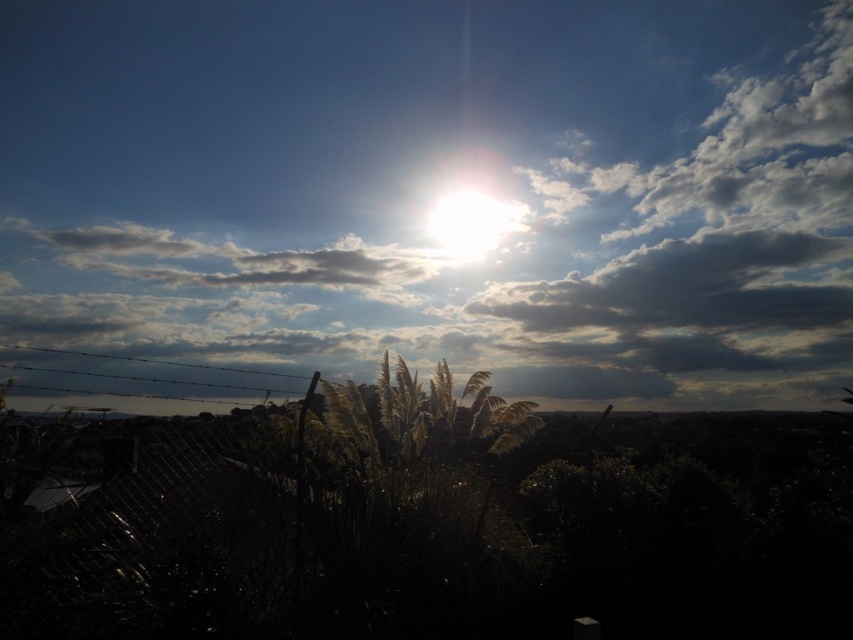
Question: Among these points, which one is nearest to the camera?

Choices:
 (A) (448, 220)
 (B) (363, 230)
 (C) (289, 545)

Answer: (C)

Question: Based on their relative distances, which object is nearer to the white fluffy cloud at upper center?

Choices:
 (A) bright white sun at upper center
 (B) silvery grass at center

Answer: (A)

Question: Does white fluffy cloud at upper center have a larger size compared to bright white sun at upper center?

Choices:
 (A) no
 (B) yes

Answer: (B)

Question: Can you confirm if white fluffy cloud at upper center is positioned to the left of silvery grass at center?

Choices:
 (A) no
 (B) yes

Answer: (B)

Question: Does white fluffy cloud at upper center have a lesser width compared to bright white sun at upper center?

Choices:
 (A) yes
 (B) no

Answer: (B)

Question: Which point is farther from the camera taking this photo?

Choices:
 (A) (252, 621)
 (B) (692, 276)
 (C) (440, 243)

Answer: (B)